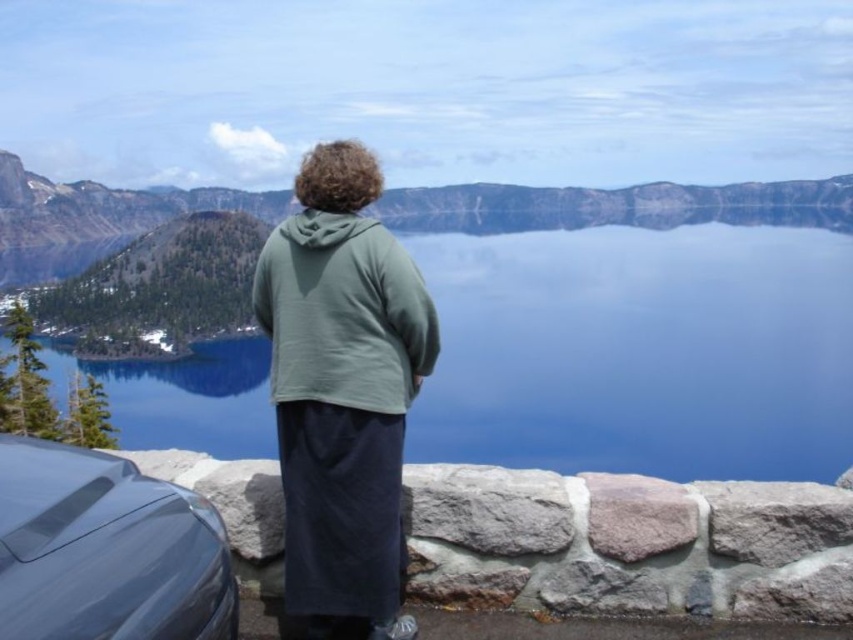
Question: Can you confirm if green matte hoodie at center is positioned above glossy metallic car at lower left?

Choices:
 (A) no
 (B) yes

Answer: (B)

Question: Is green matte hoodie at center closer to camera compared to glossy metallic car at lower left?

Choices:
 (A) no
 (B) yes

Answer: (A)

Question: Estimate the real-world distances between objects in this image. Which object is closer to the blue glassy water at center?

Choices:
 (A) glossy metallic car at lower left
 (B) green matte hoodie at center

Answer: (A)

Question: Is blue glassy water at center above green matte hoodie at center?

Choices:
 (A) no
 (B) yes

Answer: (B)

Question: Considering the real-world distances, which object is farthest from the blue glassy water at center?

Choices:
 (A) green matte hoodie at center
 (B) glossy metallic car at lower left

Answer: (A)

Question: Which object appears farthest from the camera in this image?

Choices:
 (A) glossy metallic car at lower left
 (B) green matte hoodie at center
 (C) blue glassy water at center

Answer: (C)